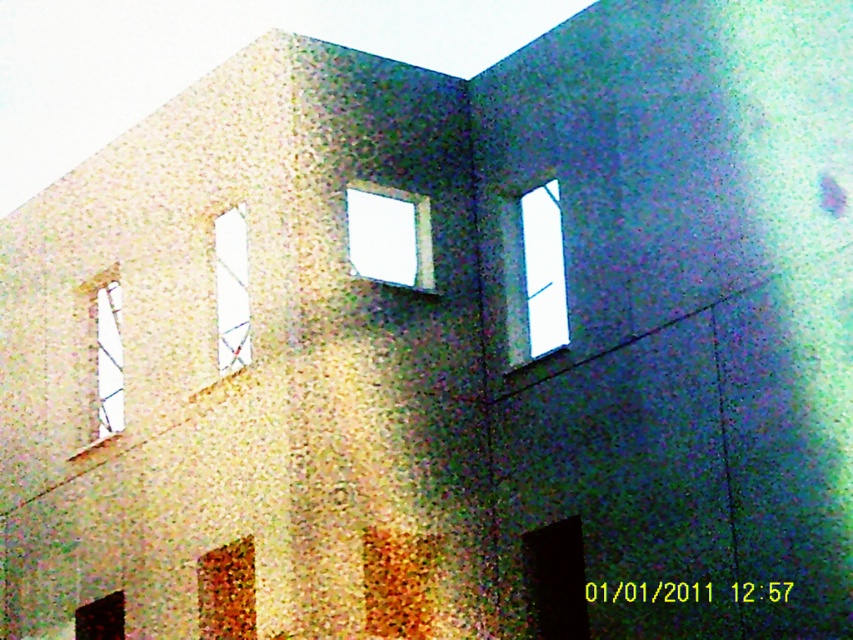
Question: Which point appears closest to the camera in this image?

Choices:
 (A) (521, 214)
 (B) (122, 637)
 (C) (97, 321)
 (D) (369, 228)

Answer: (D)

Question: Is transparent glass window at center bigger than matte brown wooden window at lower left?

Choices:
 (A) yes
 (B) no

Answer: (B)

Question: Which object is farther from the camera taking this photo?

Choices:
 (A) clear glass window at left
 (B) clear glass window at center
 (C) transparent glass window at upper right

Answer: (A)

Question: Among these objects, which one is nearest to the camera?

Choices:
 (A) matte brown wooden window at lower left
 (B) transparent glass window at upper right

Answer: (A)

Question: Is clear glass window at center smaller than matte glass window at lower left?

Choices:
 (A) yes
 (B) no

Answer: (A)

Question: Can you confirm if matte brown wooden window at lower left is smaller than clear glass window at left?

Choices:
 (A) no
 (B) yes

Answer: (B)